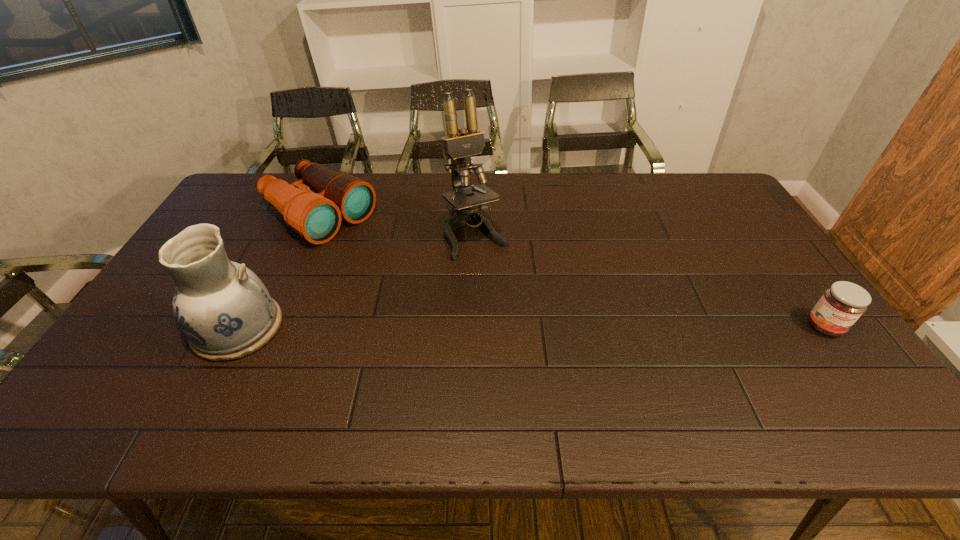
You are a GUI agent. You are given a task and a screenshot of the screen. Output one action in this format:
    pyautogui.click(x=<x>, y=<y>)
    Task: Click on the free space between the second shortest object and the rightmost object
    This screenshot has width=960, height=540.
    Given the screenshot: What is the action you would take?
    pyautogui.click(x=572, y=271)

Find the location of a particular element. This screenshot has height=540, width=960. free point between the microscope and the third tallest object is located at coordinates (397, 225).

The image size is (960, 540). In order to click on vacant area between the third tallest object and the tallest object in this screenshot , I will do `click(397, 225)`.

Identify the location of vacant area that lies between the jam and the pottery. (531, 327).

This screenshot has width=960, height=540. I want to click on vacant area between the third shortest object and the jam, so click(x=531, y=327).

Find the location of `object that is the second nearest to the second object from right to left`. object that is the second nearest to the second object from right to left is located at coordinates (223, 308).

This screenshot has width=960, height=540. Identify the location of object identified as the second closest to the third object from left to right. (223, 308).

At what (x,y) coordinates should I click in order to perform the action: click on free space that satisfies the following two spatial constraints: 1. on the front side of the binoculars; 2. on the right side of the tallest object. Please return your answer as a coordinate pair (x, y). The height and width of the screenshot is (540, 960). Looking at the image, I should click on (311, 235).

The image size is (960, 540). In order to click on free space that satisfies the following two spatial constraints: 1. on the front side of the rightmost object; 2. on the left side of the third tallest object in this screenshot , I will do click(x=272, y=326).

This screenshot has width=960, height=540. I want to click on free point that satisfies the following two spatial constraints: 1. on the back side of the rightmost object; 2. on the right side of the pottery, so click(238, 326).